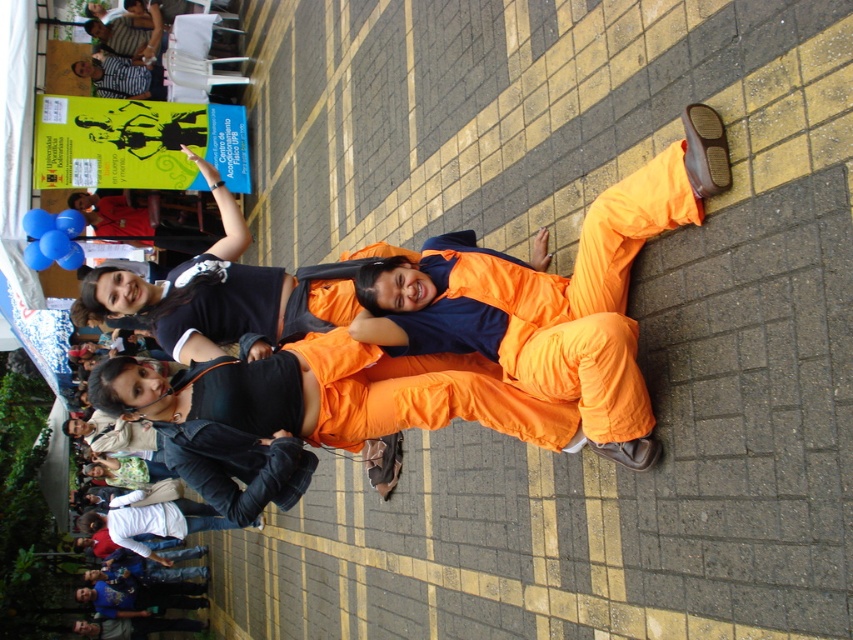
You are a costume designer assessing the two orange garments at the center of the image. Which one has a greater width between the orange fabric jumpsuit at center and the orange fabric pants at center?

The orange fabric jumpsuit at center has a greater width than the orange fabric pants at center according to the description.

You are standing at the origin point in the image. Which direction should you move to reach the orange fabric jumpsuit at center?

The orange fabric jumpsuit at center is located at point 0.458 along the x and 0.647 along the y, so you should move northeast to reach it.